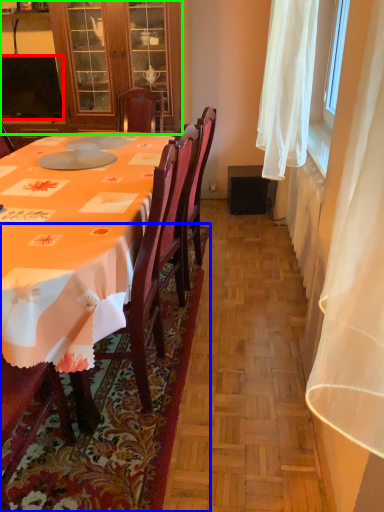
Question: Considering the real-world distances, which object is farthest from television (highlighted by a red box)? mat (highlighted by a blue box) or cabinetry (highlighted by a green box)?

Choices:
 (A) mat
 (B) cabinetry

Answer: (A)